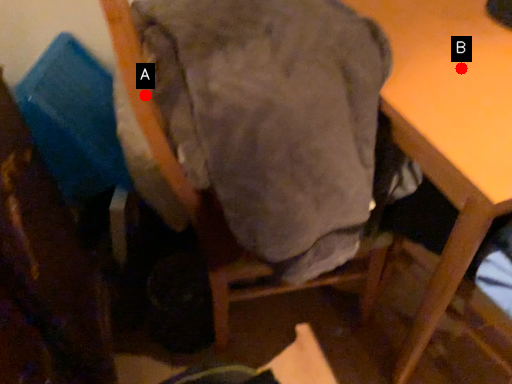
Question: Two points are circled on the image, labeled by A and B beside each circle. Which point is closer to the camera?

Choices:
 (A) A is closer
 (B) B is closer

Answer: (A)